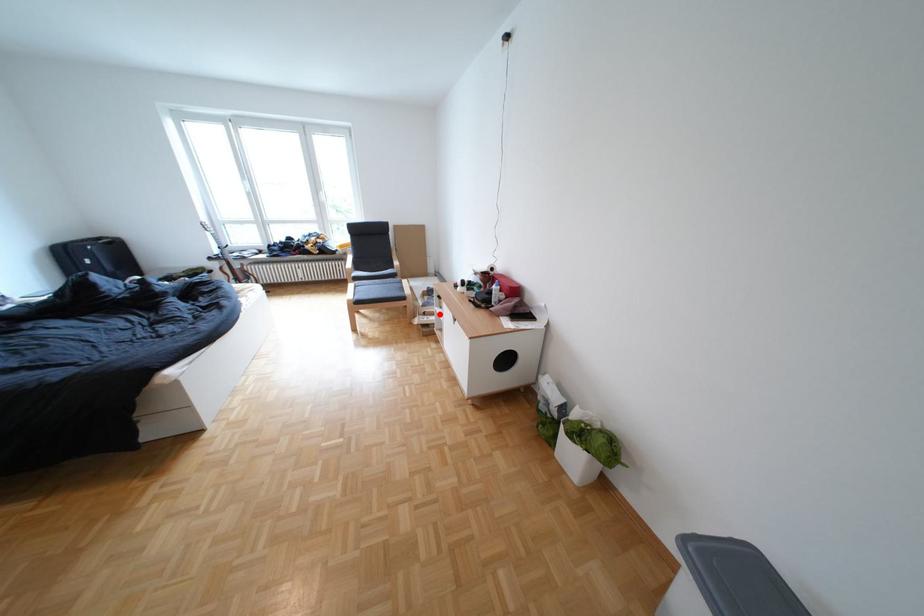
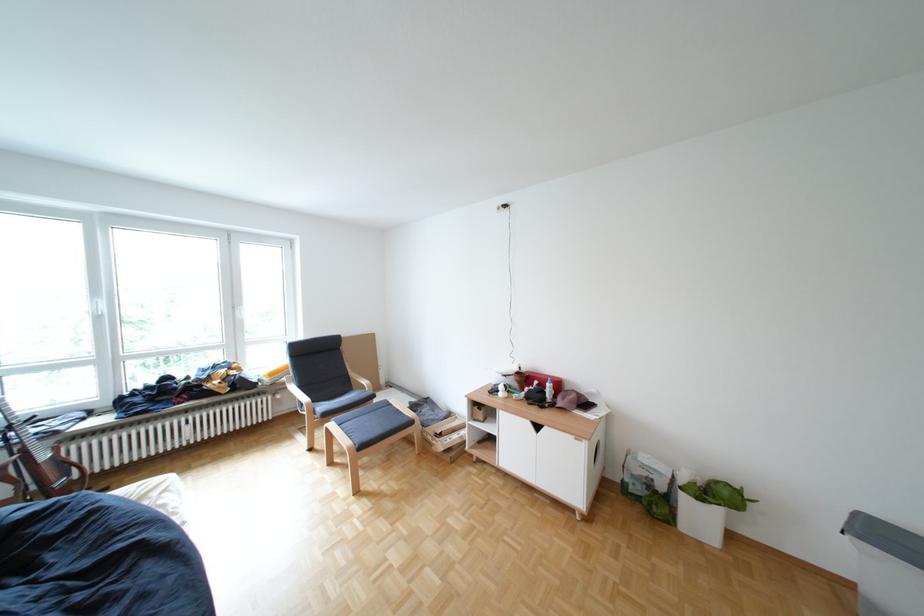
Question: A red point is marked in image1. In image2, is the corresponding 3D point closer to the camera or farther? Reply with the corresponding letter.

Choices:
 (A) The corresponding 3D point is closer.
 (B) The corresponding 3D point is farther.

Answer: (A)